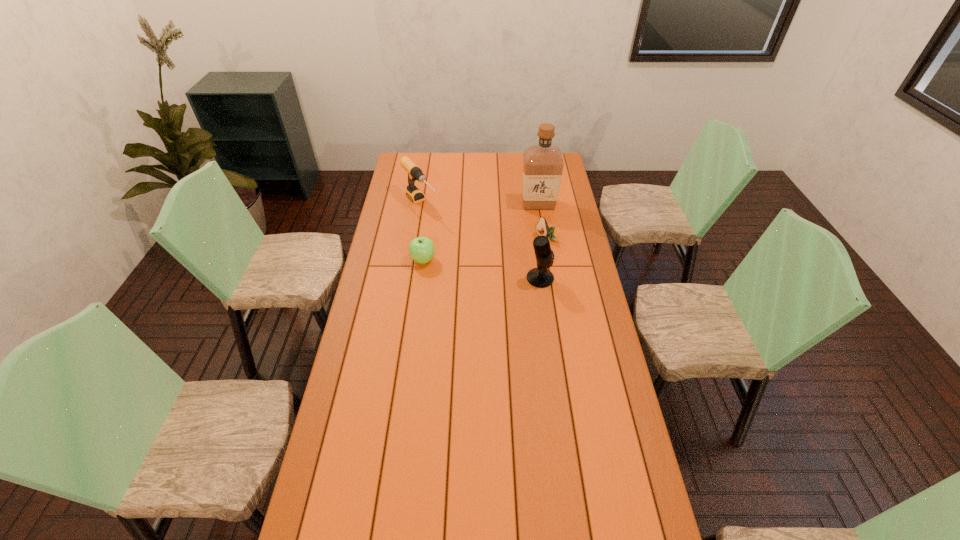
Locate an element on the screen. Image resolution: width=960 pixels, height=540 pixels. unoccupied position between the third nearest object and the drill is located at coordinates [484, 221].

Select which object appears as the second closest to the tallest object. Please provide its 2D coordinates. Your answer should be formatted as a tuple, i.e. [(x, y)], where the tuple contains the x and y coordinates of a point satisfying the conditions above.

[(415, 173)]

What are the coordinates of `object that ranks as the third closest to the avocado` in the screenshot? It's located at (421, 249).

The width and height of the screenshot is (960, 540). Identify the location of vacant area that satisfies the following two spatial constraints: 1. on the front side of the drill; 2. on the left side of the apple. (412, 260).

The width and height of the screenshot is (960, 540). Identify the location of free location that satisfies the following two spatial constraints: 1. on the front side of the third nearest object; 2. on the right side of the tallest object. (543, 239).